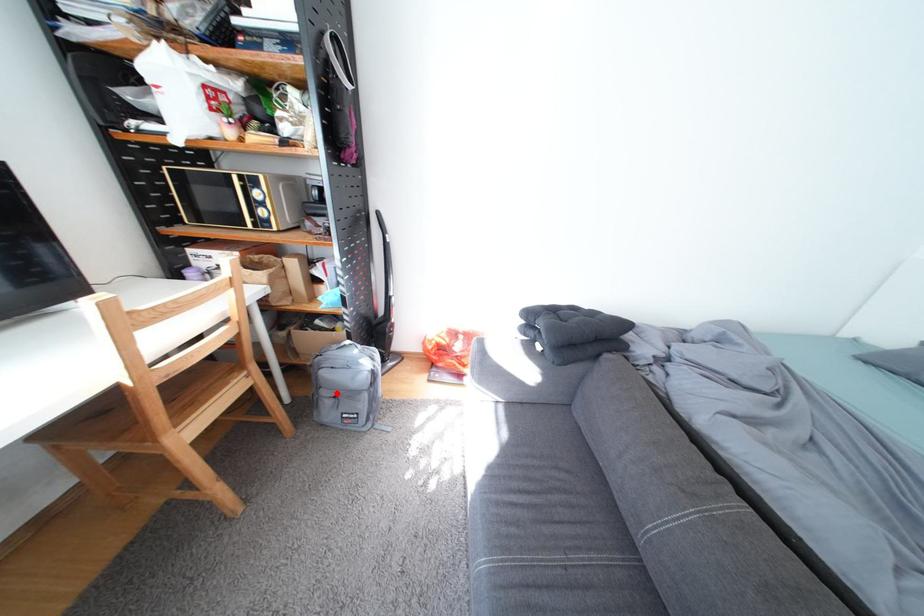
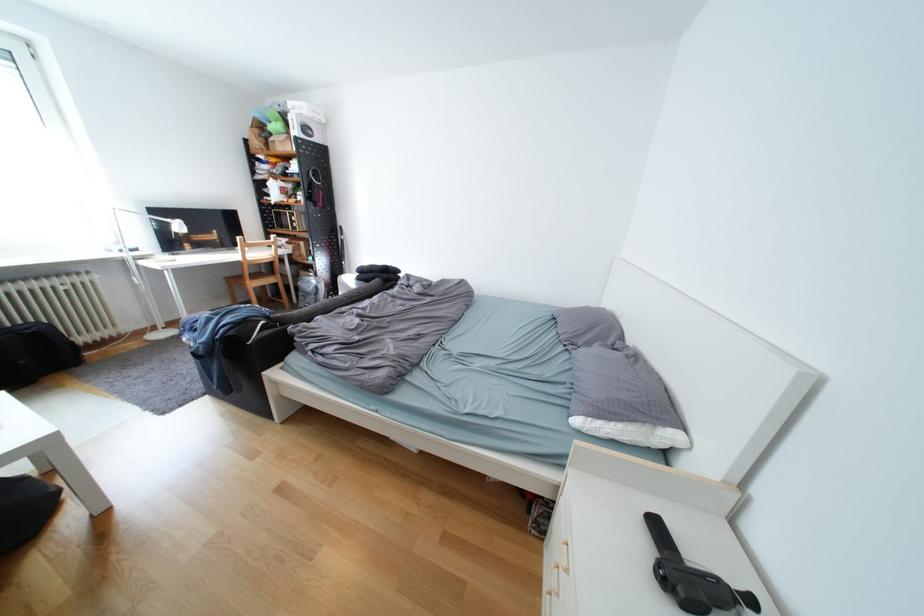
Question: I am providing you with two images of the same scene from different viewpoints. A red point is marked on the first image. Is the red point's position out of view in image 2?

Choices:
 (A) Yes
 (B) No

Answer: (B)